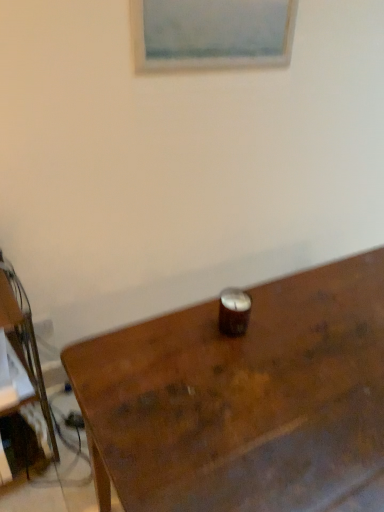
Question: Is brown wooden desk at left oriented away from matte white picture frame at upper center?

Choices:
 (A) yes
 (B) no

Answer: (B)

Question: From the image's perspective, is brown wooden desk at left under matte white picture frame at upper center?

Choices:
 (A) yes
 (B) no

Answer: (A)

Question: Is brown wooden desk at left facing towards matte white picture frame at upper center?

Choices:
 (A) yes
 (B) no

Answer: (B)

Question: Is brown wooden desk at left not near matte white picture frame at upper center?

Choices:
 (A) no
 (B) yes

Answer: (B)

Question: Does brown wooden desk at left come in front of matte white picture frame at upper center?

Choices:
 (A) yes
 (B) no

Answer: (A)

Question: Is brown wooden desk at left at the left side of matte white picture frame at upper center?

Choices:
 (A) yes
 (B) no

Answer: (A)

Question: From the image's perspective, is matte white picture frame at upper center below brown wooden desk at left?

Choices:
 (A) yes
 (B) no

Answer: (B)

Question: Can you confirm if matte white picture frame at upper center is wider than brown wooden desk at left?

Choices:
 (A) no
 (B) yes

Answer: (A)

Question: Does matte white picture frame at upper center come in front of brown wooden desk at left?

Choices:
 (A) no
 (B) yes

Answer: (A)

Question: Does matte white picture frame at upper center have a lesser width compared to brown wooden desk at left?

Choices:
 (A) yes
 (B) no

Answer: (A)

Question: From the image's perspective, is matte white picture frame at upper center over brown wooden desk at left?

Choices:
 (A) yes
 (B) no

Answer: (A)

Question: Is matte white picture frame at upper center looking in the opposite direction of brown wooden desk at left?

Choices:
 (A) yes
 (B) no

Answer: (B)

Question: Is matte white picture frame at upper center turned away from wooden table at center?

Choices:
 (A) yes
 (B) no

Answer: (B)